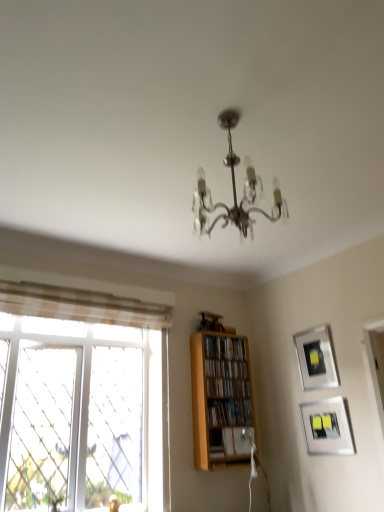
Question: Would you say wooden bookshelf at center, the 3th book from the bottom, is to the left or to the right of wooden bookshelf at center, acting as the fifth book starting from the bottom, in the picture?

Choices:
 (A) right
 (B) left

Answer: (A)

Question: From the image's perspective, relative to wooden bookshelf at center, marked as the 1th book in a top-to-bottom arrangement, is wooden bookshelf at center, the 3th book from the bottom, above or below?

Choices:
 (A) above
 (B) below

Answer: (B)

Question: Estimate the real-world distances between objects in this image. Which object is closer to the wooden bookshelf at center, the 4th book from the bottom?

Choices:
 (A) wooden bookshelf at center, the 2th book in the bottom-to-top sequence
 (B) clear glass window at left
 (C) wooden shelf at center
 (D) hardcover book at center, which appears as the first book when ordered from the bottom
 (E) matte silver picture frame at lower right, the 1th picture frame from the bottom

Answer: (C)

Question: Which object is positioned closest to the wooden bookshelf at center, acting as the fifth book starting from the bottom?

Choices:
 (A) clear glass window at left
 (B) hardcover book at center, which appears as the first book when ordered from the bottom
 (C) wooden bookshelf at center, acting as the 4th book starting from the top
 (D) wooden bookshelf at center, which is the 3th book in top-to-bottom order
 (E) matte silver picture frame at upper right, marked as the first picture frame in a top-to-bottom arrangement

Answer: (D)